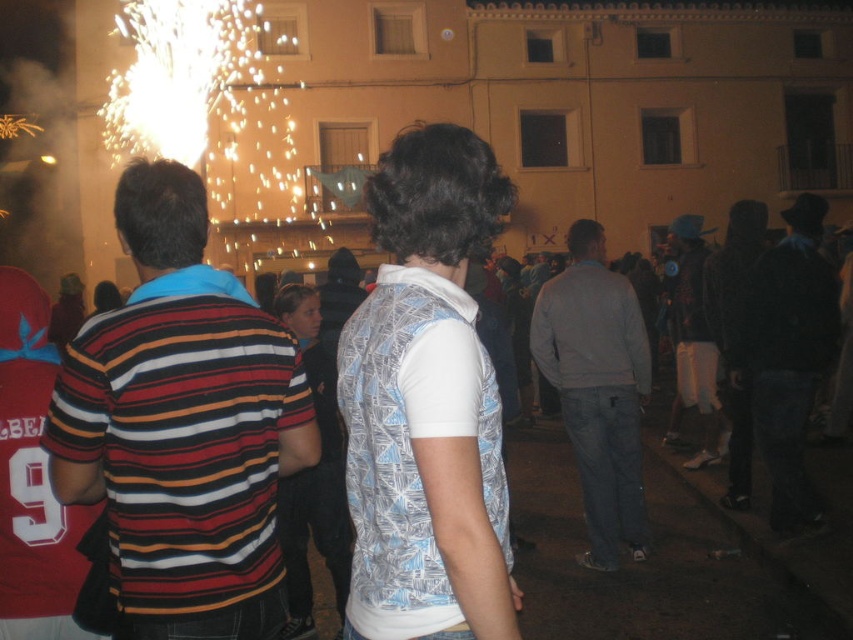
Question: Does dark blue jeans at lower right have a smaller size compared to white cotton shirt at center?

Choices:
 (A) no
 (B) yes

Answer: (B)

Question: Among these objects, which one is farthest from the camera?

Choices:
 (A) white cotton shirt at center
 (B) light gray sweater at center
 (C) striped cotton shirt at left
 (D) dark blue jeans at lower right

Answer: (A)

Question: Among these points, which one is nearest to the camera?

Choices:
 (A) (604, 508)
 (B) (683, 344)

Answer: (A)

Question: In this image, where is striped cotton shirt at left located relative to dark blue jeans at lower right?

Choices:
 (A) left
 (B) right

Answer: (A)

Question: Does light gray sweater at center appear over dark gray sweater at center?

Choices:
 (A) yes
 (B) no

Answer: (B)

Question: Considering the real-world distances, which object is farthest from the light gray sweater at center?

Choices:
 (A) dark blue jeans at lower right
 (B) white cotton shirt at center
 (C) dark gray sweater at center
 (D) striped cotton shirt at left

Answer: (D)